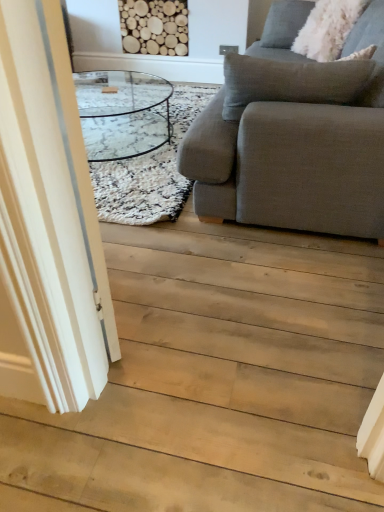
Question: Should I look upward or downward to see transparent glass door at left?

Choices:
 (A) down
 (B) up

Answer: (B)

Question: Is white fluffy pillow at upper right at the right side of gray fabric couch at right?

Choices:
 (A) no
 (B) yes

Answer: (B)

Question: Does white fluffy pillow at upper right have a greater height compared to gray fabric couch at right?

Choices:
 (A) yes
 (B) no

Answer: (B)

Question: Could you tell me if white fluffy pillow at upper right is turned towards gray fabric couch at right?

Choices:
 (A) no
 (B) yes

Answer: (B)

Question: Is white fluffy pillow at upper right completely or partially outside of gray fabric couch at right?

Choices:
 (A) yes
 (B) no

Answer: (B)

Question: Are white fluffy pillow at upper right and gray fabric couch at right making contact?

Choices:
 (A) yes
 (B) no

Answer: (B)

Question: Is white fluffy pillow at upper right positioned with its back to gray fabric couch at right?

Choices:
 (A) no
 (B) yes

Answer: (B)

Question: Can you confirm if transparent glass door at left is positioned to the right of white shaggy rug at center?

Choices:
 (A) yes
 (B) no

Answer: (A)

Question: Considering the relative sizes of transparent glass door at left and white shaggy rug at center in the image provided, is transparent glass door at left taller than white shaggy rug at center?

Choices:
 (A) yes
 (B) no

Answer: (A)

Question: From the image's perspective, does transparent glass door at left appear lower than white shaggy rug at center?

Choices:
 (A) no
 (B) yes

Answer: (B)

Question: From a real-world perspective, is transparent glass door at left located beneath white shaggy rug at center?

Choices:
 (A) no
 (B) yes

Answer: (A)

Question: Is transparent glass door at left further to the viewer compared to white shaggy rug at center?

Choices:
 (A) no
 (B) yes

Answer: (A)

Question: Is transparent glass door at left far from white shaggy rug at center?

Choices:
 (A) yes
 (B) no

Answer: (A)

Question: From a real-world perspective, is transparent glass door at left positioned under gray fabric couch at right based on gravity?

Choices:
 (A) no
 (B) yes

Answer: (A)